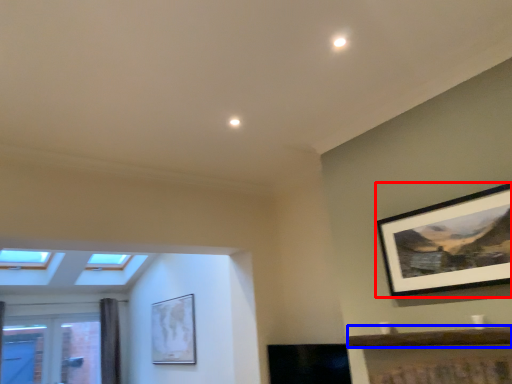
Question: Among these objects, which one is farthest to the camera, picture frame (highlighted by a red box) or window sill (highlighted by a blue box)?

Choices:
 (A) picture frame
 (B) window sill

Answer: (A)